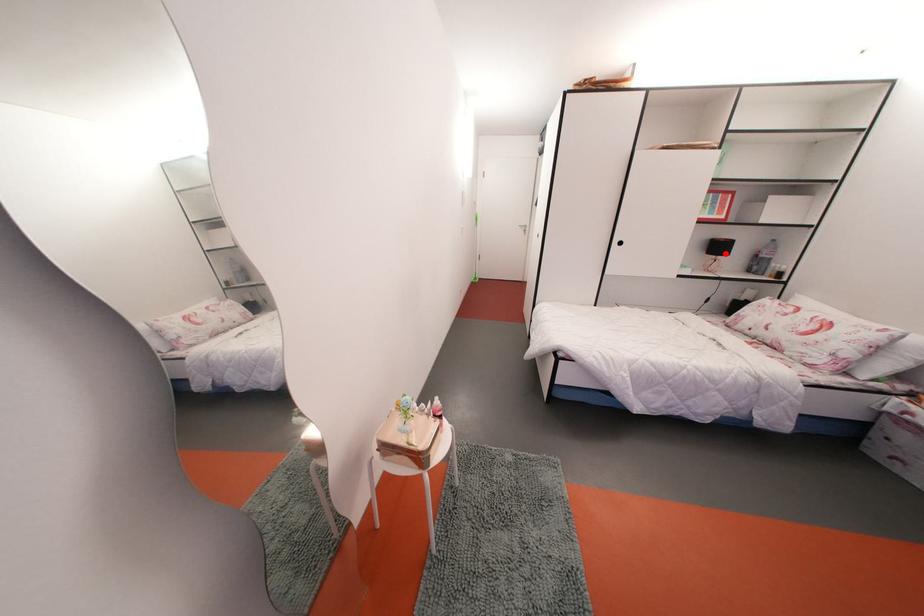
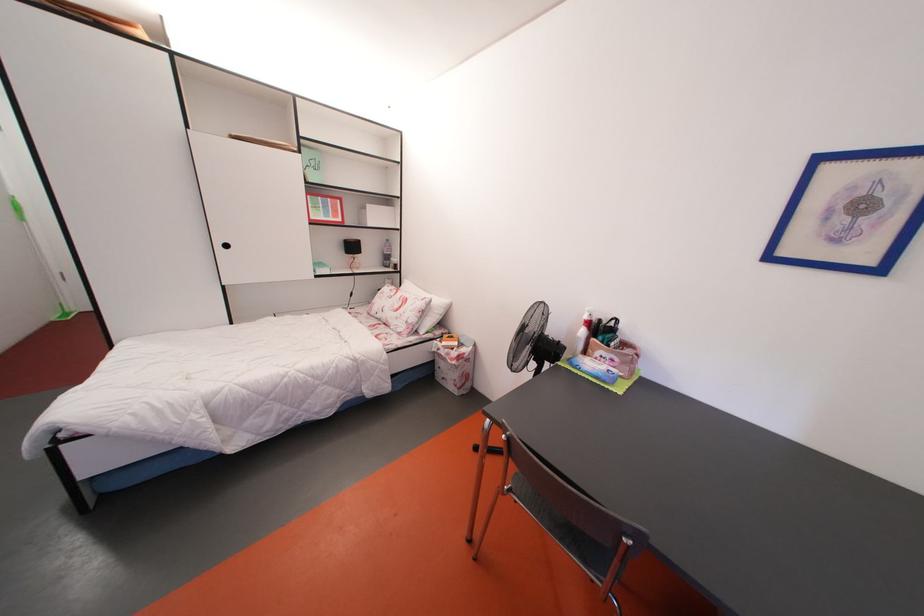
Where in the second image is the point corresponding to the highlighted location from the first image?

(359, 253)